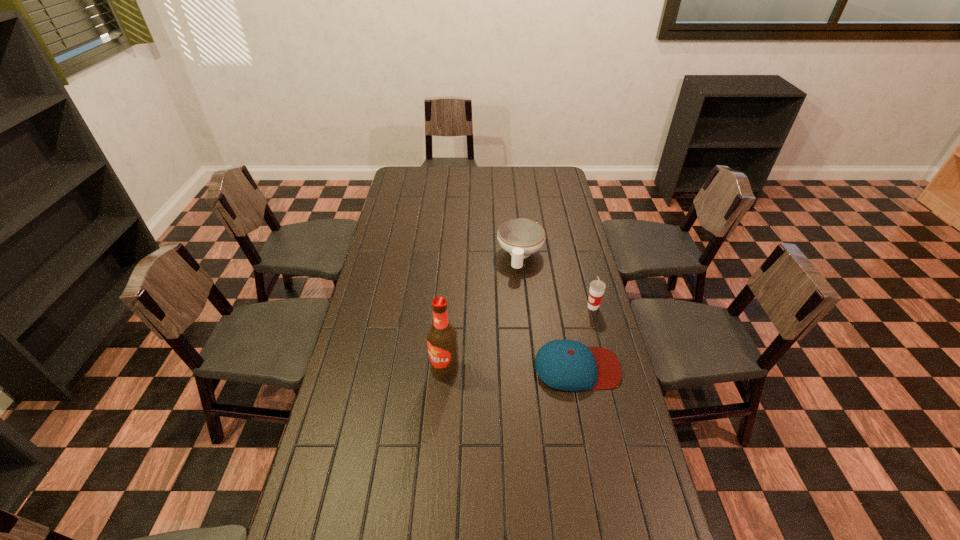
Locate an element on the screen. vacant spot on the desktop that is between the leftmost object and the baseball cap and is positioned on the side of the third nearest object with the logo is located at coordinates (501, 369).

Find the location of a particular element. Image resolution: width=960 pixels, height=540 pixels. free spot on the desktop that is between the leftmost object and the shortest object and is positioned on the side with the handle of the third tallest object is located at coordinates (499, 369).